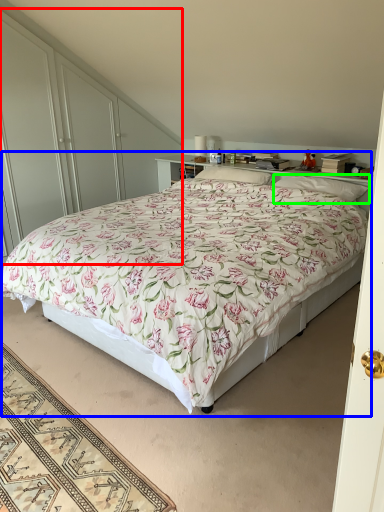
Question: Which is farther away from dresser (highlighted by a red box)? bed (highlighted by a blue box) or pillow (highlighted by a green box)?

Choices:
 (A) bed
 (B) pillow

Answer: (B)